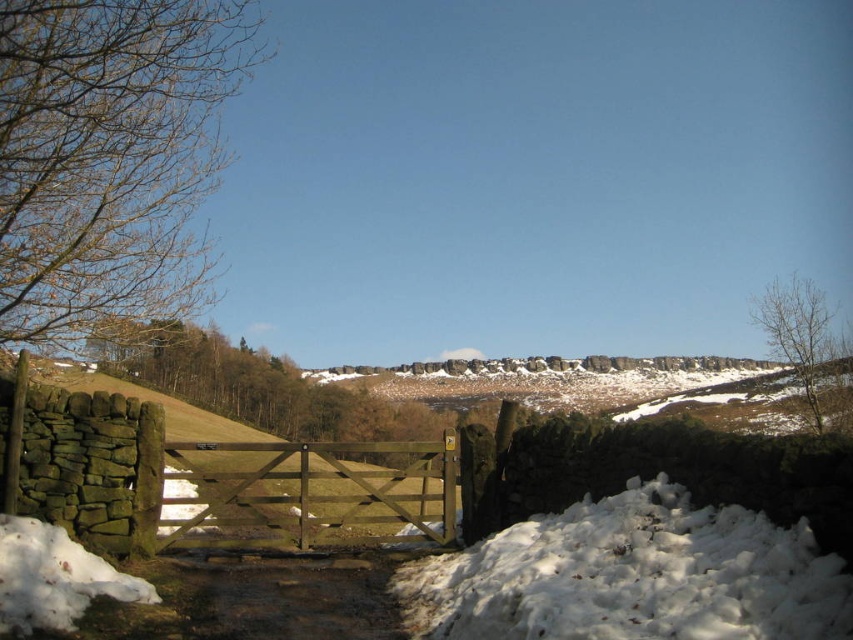
You are standing at the wooden gate with a metal latch and want to walk towards the hillside beyond it. Which direction should you head to avoid stepping on the white fluffy snow at lower right?

To avoid stepping on the white fluffy snow at lower right, you should head away from the lower right direction since the snow is located there.

You are standing at the wooden gate covered in snow and want to walk towards the hillside. There are two points marked on the path ahead of you. The first point is at coordinate point(x=714, y=548) and the second is at point(x=26, y=529). Which point should you reach first as you walk forward?

You should reach point(x=714, y=548) first because it is in front of point(x=26, y=529) along your path towards the hillside.